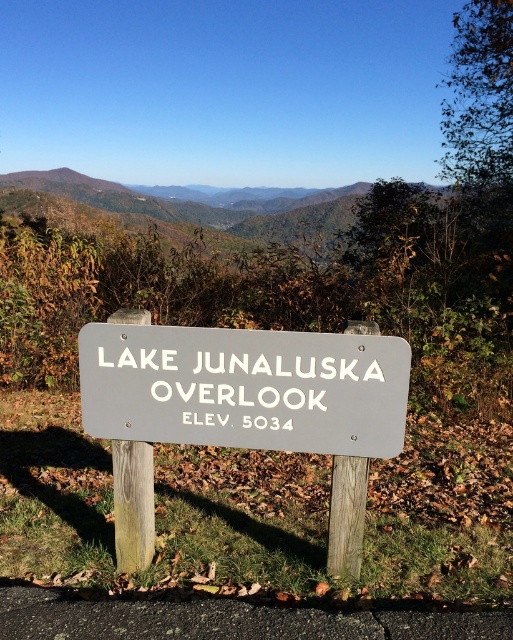
Is gray wood sign at center positioned before green leafy mountain at upper center?

That is True.

This screenshot has width=513, height=640. Identify the location of gray wood sign at center. (242, 410).

Looking at this image, who is more forward, (246,396) or (131,218)?

Point (246,396)

Where is `gray wood sign at center`? Image resolution: width=513 pixels, height=640 pixels. gray wood sign at center is located at coordinates (242, 410).